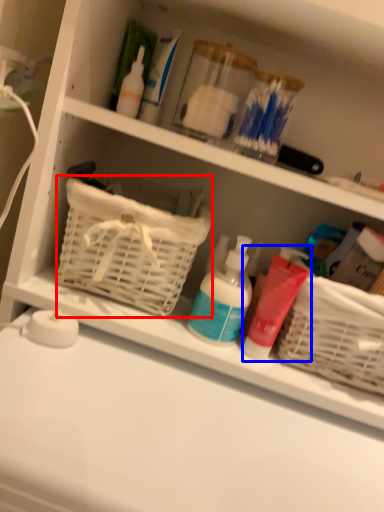
Question: Which object is further to the camera taking this photo, basket (highlighted by a red box) or cleaning product (highlighted by a blue box)?

Choices:
 (A) basket
 (B) cleaning product

Answer: (B)